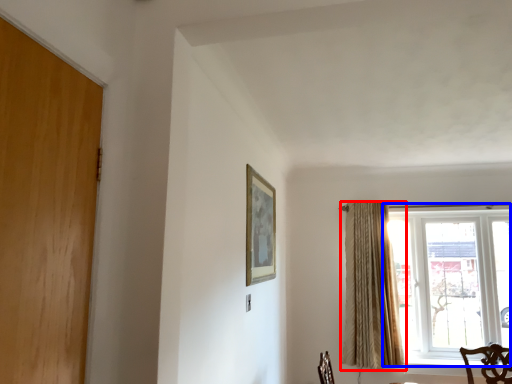
Question: Which object is closer to the camera taking this photo, curtain (highlighted by a red box) or window (highlighted by a blue box)?

Choices:
 (A) curtain
 (B) window

Answer: (A)